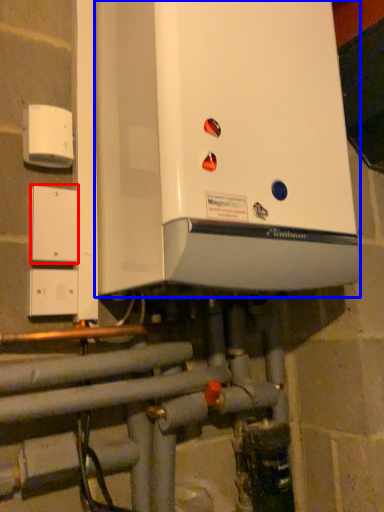
Question: Among these objects, which one is farthest to the camera, light switch (highlighted by a red box) or home appliance (highlighted by a blue box)?

Choices:
 (A) light switch
 (B) home appliance

Answer: (A)